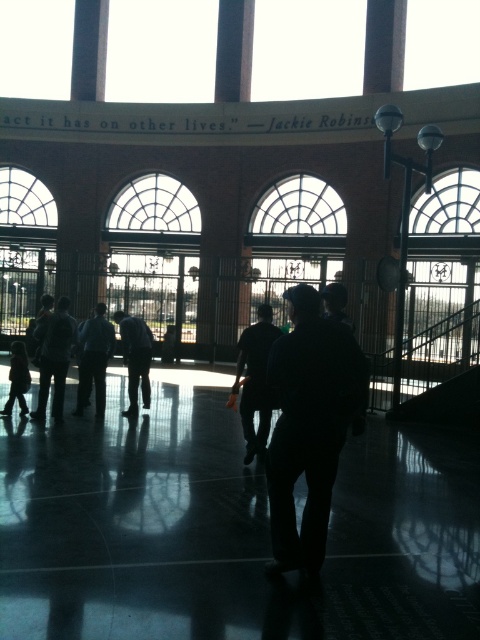
You are standing in the lobby and see the dark fabric jacket at center and the clear glass window at upper right. Which object is closer to the left side of the lobby?

The dark fabric jacket at center is closer to the left side of the lobby because it is positioned on the left side of the clear glass window at upper right.

What is the spatial relationship between the clear glass window at left and the dark blue shirt at center in the scene?

The clear glass window at left is positioned to the left of the dark blue shirt at center.

You are standing in the lobby and want to see the text on the wall. You notice the clear glass window at left and the dark blue shirt at center. Which object is closer to you, the observer?

The clear glass window at left is closer to you than the dark blue shirt at center.